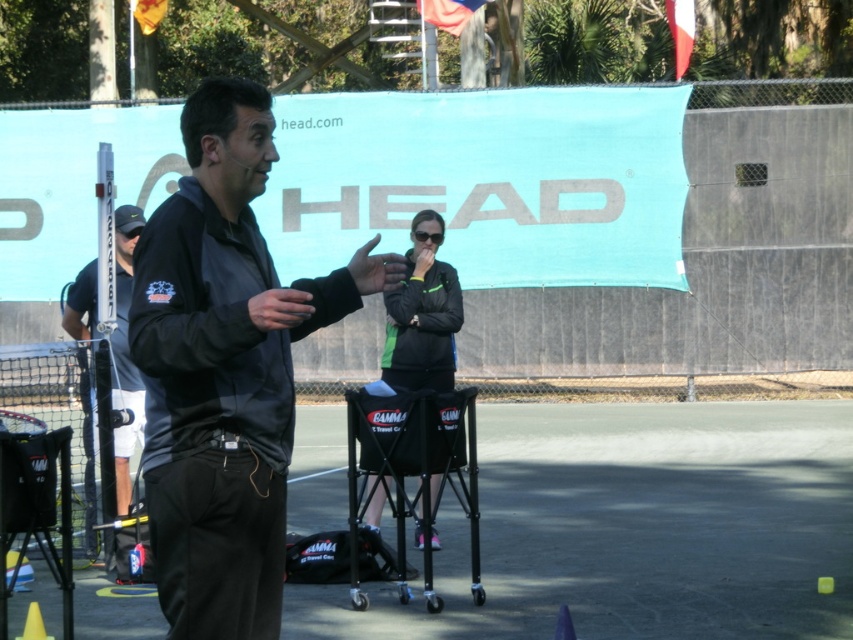
Question: Does black matte jacket at center have a larger size compared to black matte pole at left?

Choices:
 (A) no
 (B) yes

Answer: (B)

Question: Which object is farther from the camera taking this photo?

Choices:
 (A) yellow matte cone at lower left
 (B) black matte jacket at center
 (C) black fabric court at center

Answer: (C)

Question: Is black matte jacket at center thinner than yellow matte cone at lower left?

Choices:
 (A) no
 (B) yes

Answer: (A)

Question: Which of the following is the closest to the observer?

Choices:
 (A) (39, 621)
 (B) (241, 324)
 (C) (650, 512)
 (D) (129, 442)

Answer: (B)

Question: Does black fabric court at center lie in front of black matte jacket at center?

Choices:
 (A) yes
 (B) no

Answer: (B)

Question: Considering the real-world distances, which object is farthest from the black matte jacket at center?

Choices:
 (A) black fabric court at center
 (B) yellow matte cone at lower left
 (C) black matte pole at left

Answer: (A)